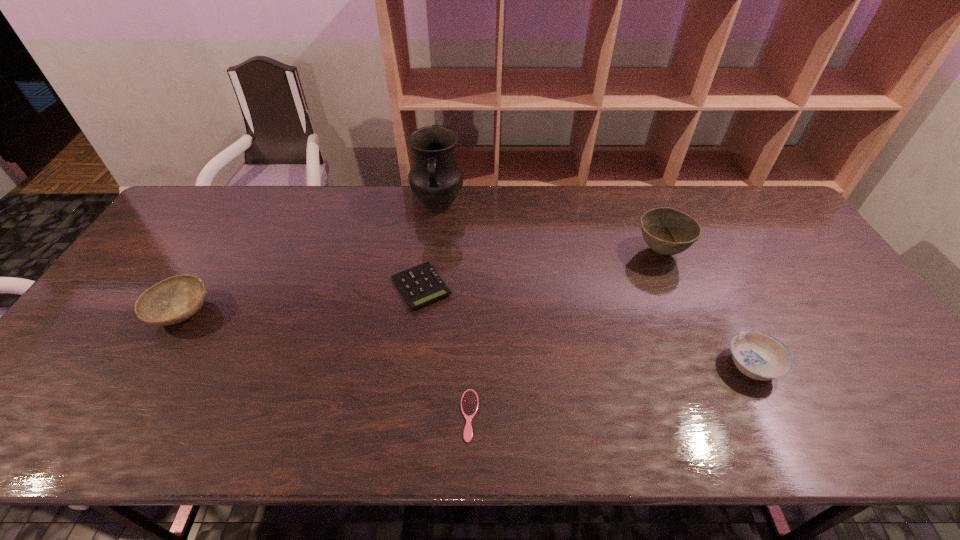
You are a GUI agent. You are given a task and a screenshot of the screen. Output one action in this format:
    pyautogui.click(x=<x>, y=<y>)
    Task: Click on the pitcher
    The image size is (960, 540).
    Given the screenshot: What is the action you would take?
    pyautogui.click(x=435, y=178)

Locate an element on the screen. This screenshot has width=960, height=540. the farthest object is located at coordinates (435, 178).

I want to click on the tallest bowl, so click(x=667, y=231).

Where is `the fifth shortest object`? Image resolution: width=960 pixels, height=540 pixels. the fifth shortest object is located at coordinates (667, 231).

This screenshot has width=960, height=540. Find the location of `the second farthest bowl`. the second farthest bowl is located at coordinates (173, 300).

Locate an element on the screen. The height and width of the screenshot is (540, 960). the leftmost bowl is located at coordinates (173, 300).

At what (x,y) coordinates should I click in order to perform the action: click on the fourth tallest object. Please return your answer as a coordinate pair (x, y). This screenshot has height=540, width=960. Looking at the image, I should click on (758, 355).

Find the location of a particular element. The image size is (960, 540). the shortest bowl is located at coordinates (758, 355).

Find the location of a particular element. The image size is (960, 540). calculator is located at coordinates (420, 285).

At what (x,y) coordinates should I click in order to perform the action: click on the shortest object. Please return your answer as a coordinate pair (x, y). Looking at the image, I should click on (469, 402).